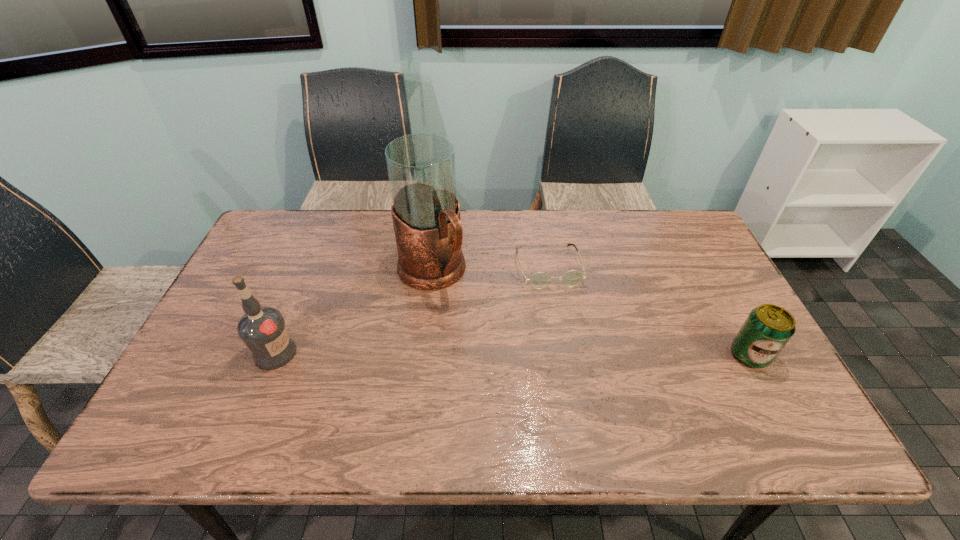
Where is `vacant space that satisfies the following two spatial constraints: 1. on the front side of the rightmost object; 2. on the right side of the pitcher`? The width and height of the screenshot is (960, 540). vacant space that satisfies the following two spatial constraints: 1. on the front side of the rightmost object; 2. on the right side of the pitcher is located at coordinates (421, 355).

Image resolution: width=960 pixels, height=540 pixels. I want to click on vacant position in the image that satisfies the following two spatial constraints: 1. on the front side of the spectacles; 2. on the left side of the beer can, so click(x=563, y=355).